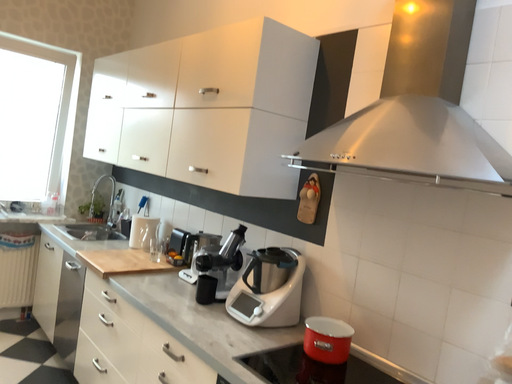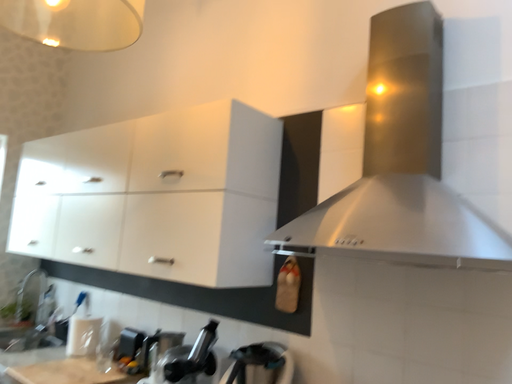
Question: Which way did the camera rotate in the video?

Choices:
 (A) rotated upward
 (B) rotated downward

Answer: (A)